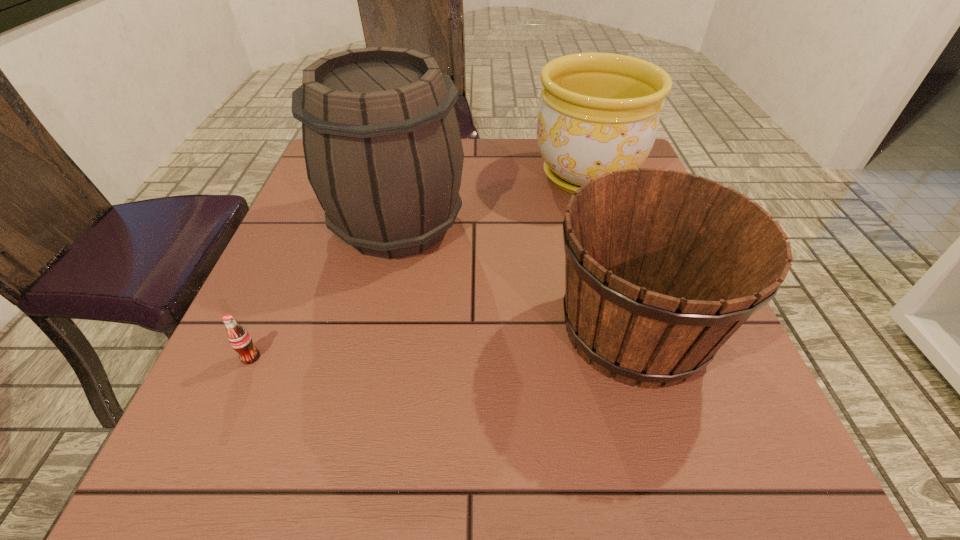
Locate an element on the screen. The image size is (960, 540). vacant area between the flowerpot and the taller wine bucket is located at coordinates (492, 200).

The height and width of the screenshot is (540, 960). Identify the location of object that ranks as the second closest to the taller wine bucket. (600, 112).

Identify which object is the third nearest to the taller wine bucket. Please provide its 2D coordinates. Your answer should be formatted as a tuple, i.e. [(x, y)], where the tuple contains the x and y coordinates of a point satisfying the conditions above.

[(240, 340)]